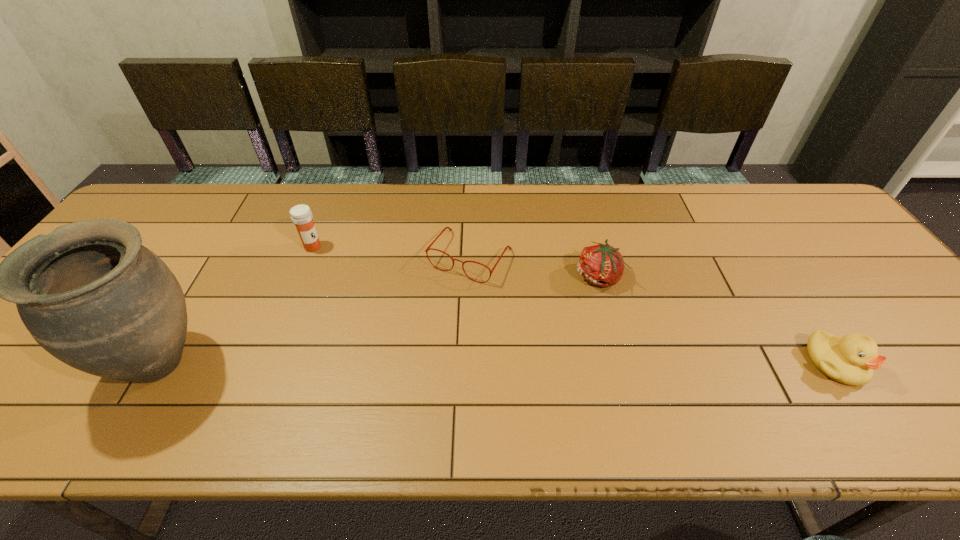
You are a GUI agent. You are given a task and a screenshot of the screen. Output one action in this format:
    pyautogui.click(x=<x>, y=<y>)
    Task: Click on the vacant region between the second tallest object and the duckling
    Image resolution: width=960 pixels, height=540 pixels.
    Given the screenshot: What is the action you would take?
    pyautogui.click(x=574, y=306)

Where is `vacant region between the fourth object from left to right and the second tallest object`? vacant region between the fourth object from left to right and the second tallest object is located at coordinates (455, 262).

Where is `free area in between the shortest object and the medicine`? This screenshot has width=960, height=540. free area in between the shortest object and the medicine is located at coordinates (392, 252).

The width and height of the screenshot is (960, 540). Identify the location of vacant space that is in between the leftmost object and the rightmost object. (498, 363).

Image resolution: width=960 pixels, height=540 pixels. I want to click on free space that is in between the duckling and the tallest object, so click(498, 363).

Find the location of a particular element. Image resolution: width=960 pixels, height=540 pixels. free area in between the tallest object and the tomato is located at coordinates (380, 319).

Locate which object ranks third in proximity to the shortest object. Please provide its 2D coordinates. Your answer should be formatted as a tuple, i.e. [(x, y)], where the tuple contains the x and y coordinates of a point satisfying the conditions above.

[(89, 293)]

At what (x,y) coordinates should I click in order to perform the action: click on the closest object to the second tallest object. Please return your answer as a coordinate pair (x, y). The height and width of the screenshot is (540, 960). Looking at the image, I should click on (89, 293).

The height and width of the screenshot is (540, 960). I want to click on free spot that satisfies the following two spatial constraints: 1. on the front side of the shortest object; 2. on the left side of the tomato, so click(469, 276).